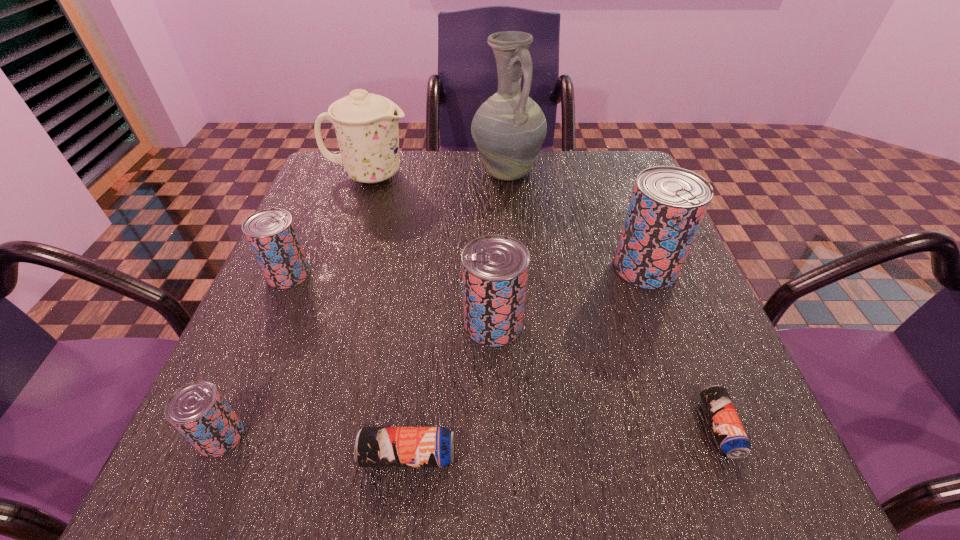
The height and width of the screenshot is (540, 960). Find the location of `the tallest object`. the tallest object is located at coordinates point(508,129).

Locate an element on the screen. This screenshot has height=540, width=960. chinaware is located at coordinates (366, 125).

Where is `the tallest beer can`? This screenshot has height=540, width=960. the tallest beer can is located at coordinates tap(668, 204).

You are a GUI agent. You are given a task and a screenshot of the screen. Output one action in this format:
    pyautogui.click(x=<x>, y=<y>)
    Task: Click on the biggest red beer can
    The width and height of the screenshot is (960, 540).
    Given the screenshot: What is the action you would take?
    pyautogui.click(x=668, y=204)

You are a GUI agent. You are given a task and a screenshot of the screen. Output one action in this format:
    pyautogui.click(x=<x>, y=<y>)
    Task: Click on the fourth tallest object
    The width and height of the screenshot is (960, 540).
    Given the screenshot: What is the action you would take?
    pyautogui.click(x=495, y=268)

Find the location of a particular element. The width and height of the screenshot is (960, 540). the fifth farthest object is located at coordinates (495, 268).

At what (x,y) coordinates should I click in order to perform the action: click on the fourth shortest beer can. Please return your answer as a coordinate pair (x, y). The height and width of the screenshot is (540, 960). Looking at the image, I should click on (271, 233).

The image size is (960, 540). Identify the location of the fourth shortest object. (271, 233).

The width and height of the screenshot is (960, 540). I want to click on the fourth tallest beer can, so click(x=198, y=410).

Where is `the smallest red beer can`? the smallest red beer can is located at coordinates [x=198, y=410].